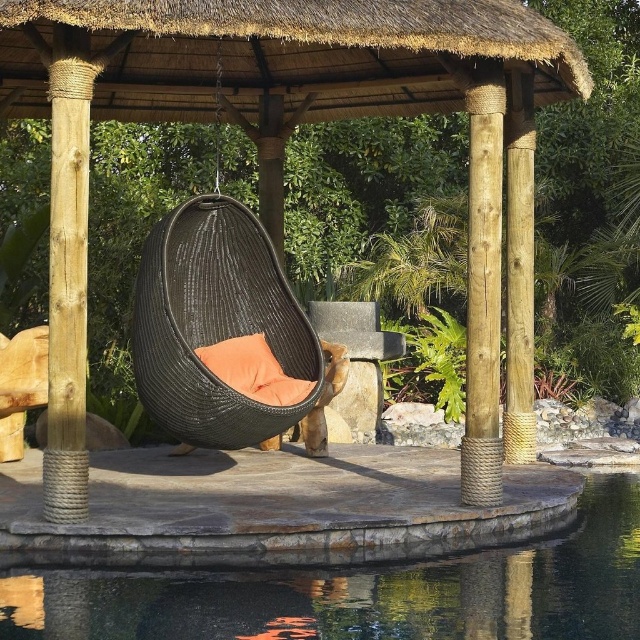
Question: Where is transparent glass pond at center located in relation to natural wood pole at left in the image?

Choices:
 (A) left
 (B) right

Answer: (B)

Question: Which point is farther to the camera?

Choices:
 (A) natural wood pole at left
 (B) transparent glass pond at center

Answer: (B)

Question: Which point is closer to the camera?

Choices:
 (A) (296, 573)
 (B) (484, 116)

Answer: (A)

Question: Which object appears closest to the camera in this image?

Choices:
 (A) transparent glass pond at center
 (B) rope-wrapped wood pole at right
 (C) natural wood pole at left
 (D) orange woven pillow at center

Answer: (C)

Question: Does natural wood pole at left appear on the right side of rope-wrapped wood pole at right?

Choices:
 (A) yes
 (B) no

Answer: (B)

Question: Does transparent glass pond at center have a larger size compared to natural wood pole at left?

Choices:
 (A) yes
 (B) no

Answer: (B)